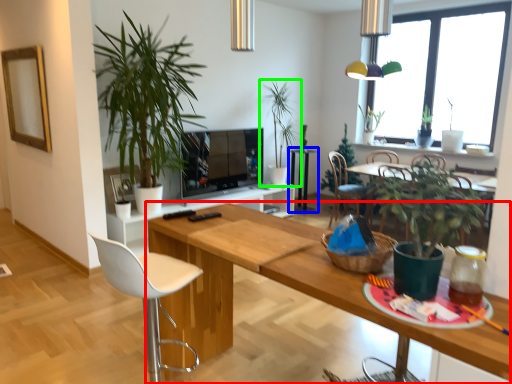
Question: Which is nearer to the table (highlighted by a red box)? side table (highlighted by a blue box) or houseplant (highlighted by a green box).

Choices:
 (A) side table
 (B) houseplant

Answer: (B)